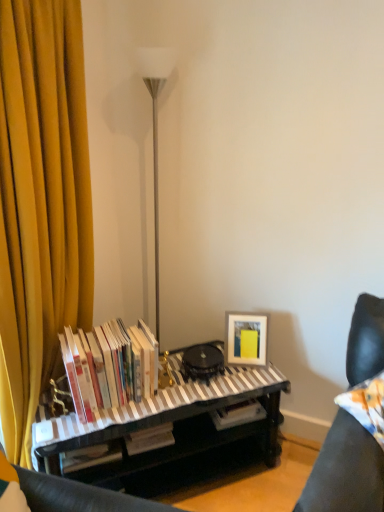
The image size is (384, 512). Describe the element at coordinates (41, 204) in the screenshot. I see `yellow fabric curtain at left` at that location.

What do you see at coordinates (153, 419) in the screenshot?
I see `striped fabric piano at center` at bounding box center [153, 419].

Locate an element on the screen. This screenshot has width=384, height=512. yellow fabric curtain at left is located at coordinates (41, 204).

Is matte white picture frame at lower right far away from striped fabric piano at center?

No, there isn't a large distance between matte white picture frame at lower right and striped fabric piano at center.

Does matte white picture frame at lower right have a larger size compared to striped fabric piano at center?

Incorrect, matte white picture frame at lower right is not larger than striped fabric piano at center.

Considering the sizes of matte white picture frame at lower right and striped fabric piano at center in the image, is matte white picture frame at lower right wider or thinner than striped fabric piano at center?

matte white picture frame at lower right is thinner than striped fabric piano at center.

In the image, is matte white picture frame at lower right positioned in front of or behind striped fabric piano at center?

matte white picture frame at lower right is positioned farther from the viewer than striped fabric piano at center.

Is leather couch cushion at lower right looking in the opposite direction of yellow fabric curtain at left?

No, yellow fabric curtain at left is not at the back of leather couch cushion at lower right.

How much distance is there between leather couch cushion at lower right and yellow fabric curtain at left?

leather couch cushion at lower right and yellow fabric curtain at left are 4.09 feet apart from each other.

Choose the correct answer: Is leather couch cushion at lower right inside yellow fabric curtain at left or outside it?

leather couch cushion at lower right is not inside yellow fabric curtain at left, it's outside.

Considering the sizes of leather couch cushion at lower right and yellow fabric curtain at left in the image, is leather couch cushion at lower right taller or shorter than yellow fabric curtain at left?

Considering their sizes, leather couch cushion at lower right has less height than yellow fabric curtain at left.

In the scene shown: Is striped fabric piano at center positioned far away from yellow fabric curtain at left?

striped fabric piano at center is actually quite close to yellow fabric curtain at left.

Could you tell me if striped fabric piano at center is facing yellow fabric curtain at left?

No, striped fabric piano at center is not aimed at yellow fabric curtain at left.

In terms of height, does striped fabric piano at center look taller or shorter compared to yellow fabric curtain at left?

Considering their sizes, striped fabric piano at center has less height than yellow fabric curtain at left.

Would you say striped fabric piano at center is outside yellow fabric curtain at left?

striped fabric piano at center is positioned outside yellow fabric curtain at left.

Is striped fabric piano at center facing away from leather couch cushion at lower right?

No, striped fabric piano at center is not facing the opposite direction of leather couch cushion at lower right.

Where is `furniture that is in front of the striped fabric piano at center`? The height and width of the screenshot is (512, 384). furniture that is in front of the striped fabric piano at center is located at coordinates (345, 471).

From the image's perspective, is striped fabric piano at center above or below leather couch cushion at lower right?

striped fabric piano at center is below leather couch cushion at lower right.

From a real-world perspective, is striped fabric piano at center below leather couch cushion at lower right?

Yes, from a real-world perspective, striped fabric piano at center is below leather couch cushion at lower right.

Could you tell me if white paper book at left is turned towards matte white picture frame at lower right?

No, white paper book at left does not turn towards matte white picture frame at lower right.

Between point (104, 407) and point (257, 337), which one is positioned behind?

Positioned behind is point (257, 337).

Which object is closer to the camera, white paper book at left or matte white picture frame at lower right?

white paper book at left is more forward.

Is white paper book at left far away from matte white picture frame at lower right?

They are positioned close to each other.

Considering the relative sizes of matte white picture frame at lower right and leather couch cushion at lower right in the image provided, is matte white picture frame at lower right bigger than leather couch cushion at lower right?

Incorrect, matte white picture frame at lower right is not larger than leather couch cushion at lower right.

Could you tell me if matte white picture frame at lower right is facing leather couch cushion at lower right?

No.

Does point (232, 333) appear closer or farther from the camera than point (360, 301)?

Clearly, point (232, 333) is more distant from the camera than point (360, 301).

Considering the sizes of objects matte white picture frame at lower right and leather couch cushion at lower right in the image provided, who is thinner, matte white picture frame at lower right or leather couch cushion at lower right?

Thinner between the two is matte white picture frame at lower right.

What are the coordinates of `curtain above the matte white picture frame at lower right (from a real-world perspective)` in the screenshot? It's located at (41, 204).

Is yellow fabric curtain at left next to matte white picture frame at lower right?

No, yellow fabric curtain at left is not making contact with matte white picture frame at lower right.

In the scene shown: Is yellow fabric curtain at left wider than matte white picture frame at lower right?

Yes, yellow fabric curtain at left is wider than matte white picture frame at lower right.

From the image's perspective, is yellow fabric curtain at left under matte white picture frame at lower right?

No.

Locate an element on the screen. picture frame that appears above the striped fabric piano at center (from the image's perspective) is located at coordinates pos(246,339).

I want to click on furniture below the yellow fabric curtain at left (from the image's perspective), so click(345, 471).

Which object lies further to the anchor point yellow fabric curtain at left, leather couch cushion at lower right or white paper book at left?

The object further to yellow fabric curtain at left is leather couch cushion at lower right.

Estimate the real-world distances between objects in this image. Which object is closer to leather couch cushion at lower right, yellow fabric curtain at left or striped fabric piano at center?

striped fabric piano at center.

Looking at the image, which one is located closer to white paper book at left, striped fabric piano at center or yellow fabric curtain at left?

Among the two, striped fabric piano at center is located nearer to white paper book at left.

Based on their spatial positions, is white paper book at left or leather couch cushion at lower right closer to matte white picture frame at lower right?

Based on the image, white paper book at left appears to be nearer to matte white picture frame at lower right.

When comparing their distances from leather couch cushion at lower right, does matte white picture frame at lower right or yellow fabric curtain at left seem further?

yellow fabric curtain at left is further to leather couch cushion at lower right.

Based on their spatial positions, is yellow fabric curtain at left or leather couch cushion at lower right closer to striped fabric piano at center?

yellow fabric curtain at left is closer to striped fabric piano at center.

Looking at the image, which one is located further to white paper book at left, leather couch cushion at lower right or yellow fabric curtain at left?

The object further to white paper book at left is leather couch cushion at lower right.

Looking at the image, which one is located further to striped fabric piano at center, matte white picture frame at lower right or yellow fabric curtain at left?

yellow fabric curtain at left lies further to striped fabric piano at center than the other object.

Find the location of a particular element. piano between white paper book at left and matte white picture frame at lower right in the horizontal direction is located at coordinates (153, 419).

The image size is (384, 512). Find the location of `piano between yellow fabric curtain at left and leather couch cushion at lower right`. piano between yellow fabric curtain at left and leather couch cushion at lower right is located at coordinates (153, 419).

Locate an element on the screen. This screenshot has width=384, height=512. piano positioned between leather couch cushion at lower right and matte white picture frame at lower right from near to far is located at coordinates (153, 419).

This screenshot has width=384, height=512. Identify the location of piano between white paper book at left and leather couch cushion at lower right in the horizontal direction. (153, 419).